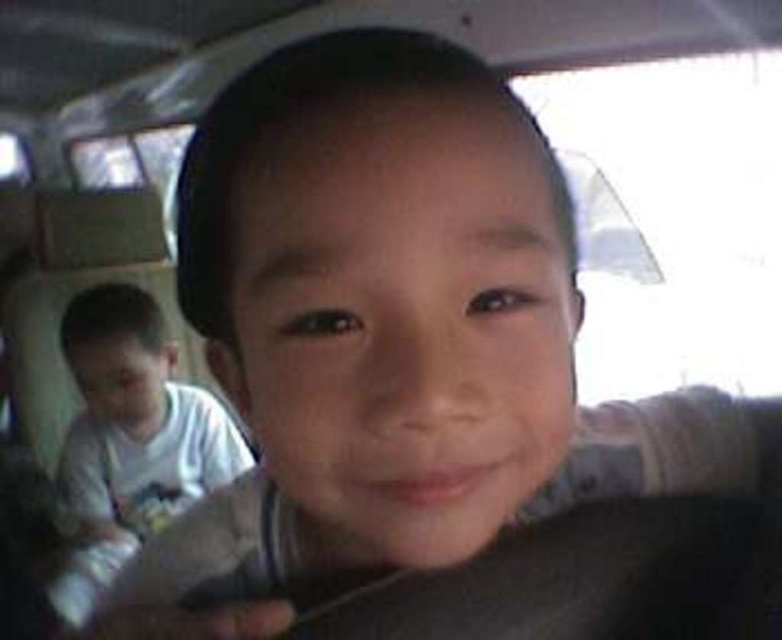
Between transparent plastic car window at upper right and white cotton shirt at center, which one appears on the left side from the viewer's perspective?

white cotton shirt at center

Is transparent plastic car window at upper right thinner than white cotton shirt at center?

In fact, transparent plastic car window at upper right might be wider than white cotton shirt at center.

Where is `transparent plastic car window at upper right`? This screenshot has width=782, height=640. transparent plastic car window at upper right is located at coordinates (673, 218).